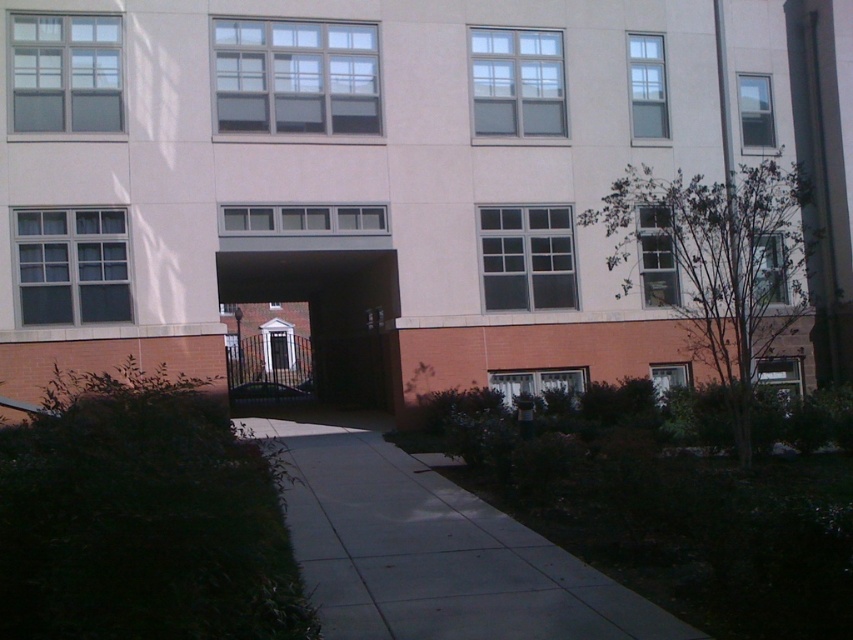
You are a delivery person with a cart that is 2 meters wide. You need to transport a package through the gray concrete sidewalk at center and the dark brown wooden gate at center. Which path allows your cart to pass through without needing to adjust its width?

The dark brown wooden gate at center has a greater width than the gray concrete sidewalk at center, so the cart can pass through the dark brown wooden gate at center without needing to adjust its width.